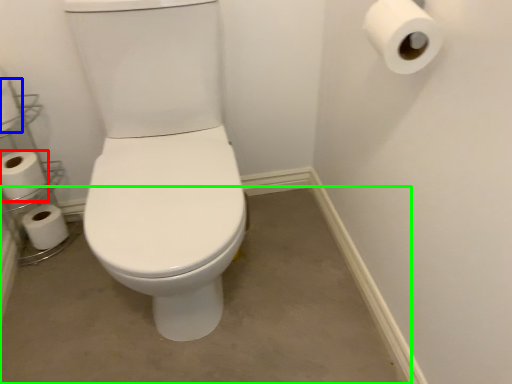
Question: Considering the real-world distances, which object is closest to toilet paper (highlighted by a red box)? toilet paper (highlighted by a blue box) or concrete (highlighted by a green box).

Choices:
 (A) toilet paper
 (B) concrete

Answer: (A)